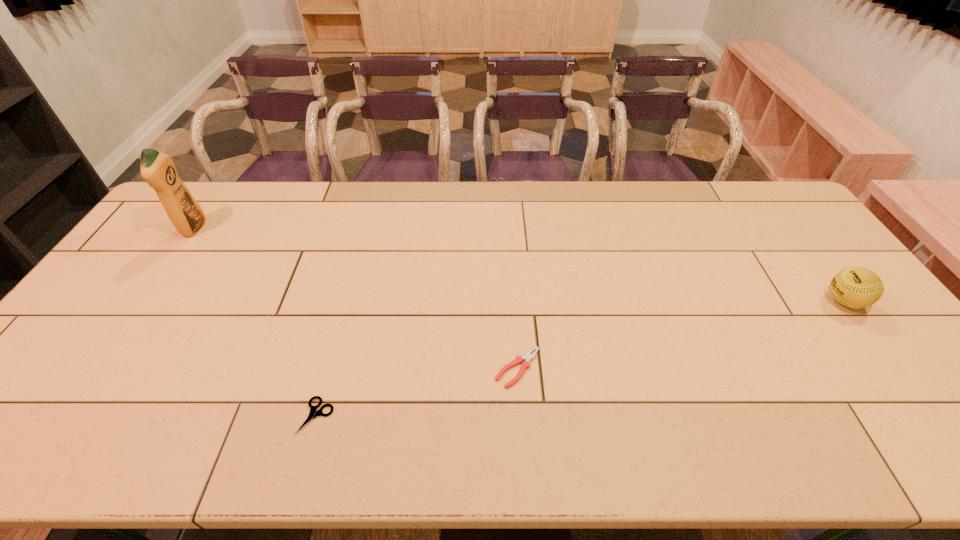
Where is `the farthest object`? This screenshot has height=540, width=960. the farthest object is located at coordinates (158, 170).

Identify the location of the leftmost object. (158, 170).

This screenshot has height=540, width=960. I want to click on the rightmost object, so click(x=855, y=287).

Where is `the second farthest object`? This screenshot has height=540, width=960. the second farthest object is located at coordinates (855, 287).

Image resolution: width=960 pixels, height=540 pixels. Find the location of `the second object from right to left`. the second object from right to left is located at coordinates (527, 357).

Identify the location of the second nearest object. The width and height of the screenshot is (960, 540). (527, 357).

Where is `the nearest object`? The width and height of the screenshot is (960, 540). the nearest object is located at coordinates (313, 413).

I want to click on the second object from left to right, so click(x=313, y=413).

Identify the location of vacant space located on the label of the detergent. (288, 228).

Where is `free space located on the logo side of the second tallest object`? Image resolution: width=960 pixels, height=540 pixels. free space located on the logo side of the second tallest object is located at coordinates (781, 301).